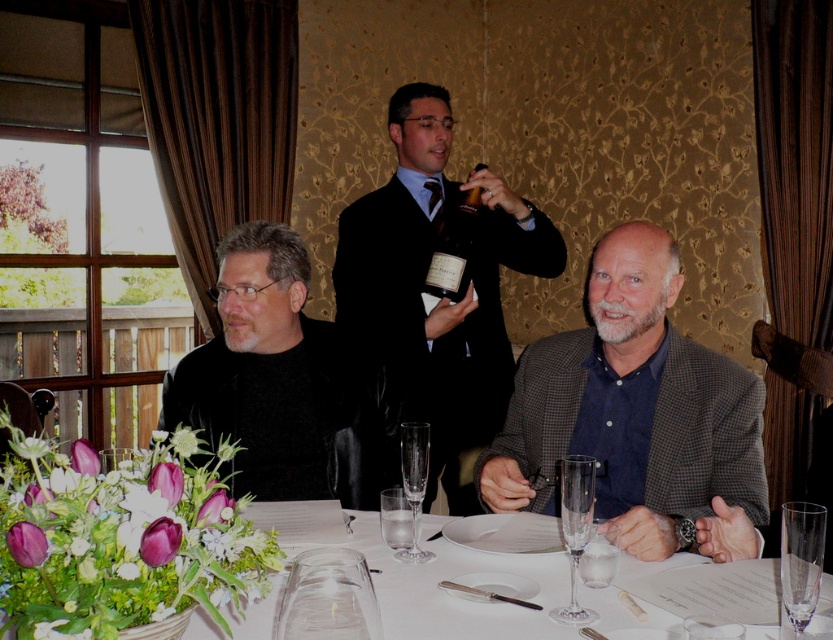
Question: Which of the following is the closest to the observer?

Choices:
 (A) (466, 632)
 (B) (576, 554)
 (C) (416, 436)

Answer: (A)

Question: Is the position of black matte jacket at left more distant than that of white porcelain vase at lower left?

Choices:
 (A) no
 (B) yes

Answer: (B)

Question: Which object is closer to the camera taking this photo?

Choices:
 (A) clear glass wine glass at center
 (B) white porcelain vase at lower left
 (C) shiny dark brown bottle at center

Answer: (B)

Question: Does transparent glass at lower right have a smaller size compared to clear glass wine glass at lower center?

Choices:
 (A) no
 (B) yes

Answer: (A)

Question: Does shiny black suit at center appear on the left side of gray checkered blazer at lower right?

Choices:
 (A) yes
 (B) no

Answer: (A)

Question: Which point is closer to the camera?

Choices:
 (A) (292, 248)
 (B) (801, 531)
 (C) (610, 534)

Answer: (B)